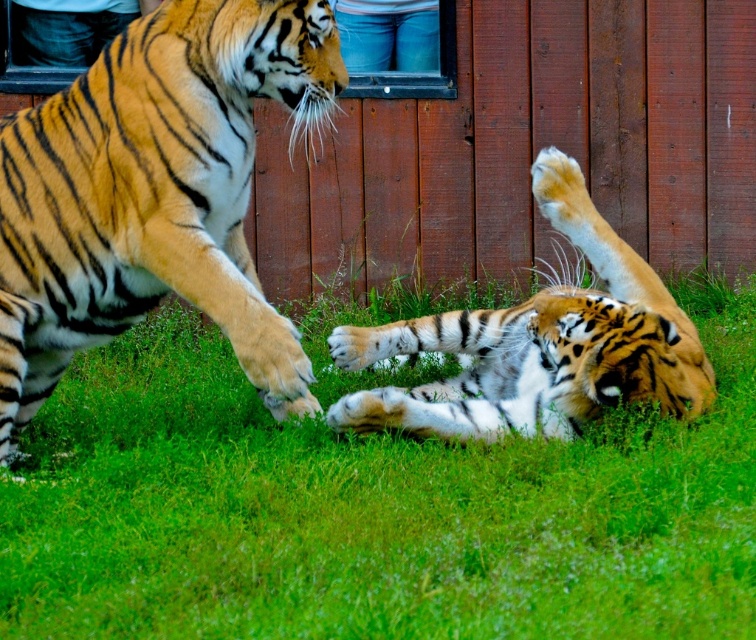
You are observing two tigers in a grassy area. The orange fur tiger at left and the orange and black striped tiger at lower right are positioned in a certain way. Which tiger is positioned more to the left side of the image?

The orange fur tiger at left is positioned more to the left side of the image than the orange and black striped tiger at lower right.

You are a wildlife photographer trying to capture a photo of both the orange fur tiger at left and the orange and black striped tiger at lower right. Based on their sizes in the image, which tiger would appear smaller in your photo?

The orange fur tiger at left appears smaller in the photo because it occupies less space than the orange and black striped tiger at lower right.